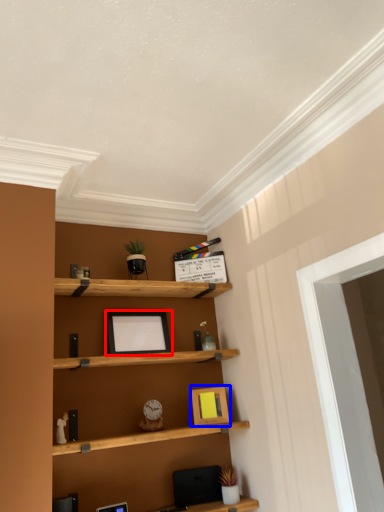
Question: Which of the following is the farthest to the observer, picture frame (highlighted by a red box) or picture frame (highlighted by a blue box)?

Choices:
 (A) picture frame
 (B) picture frame

Answer: (B)